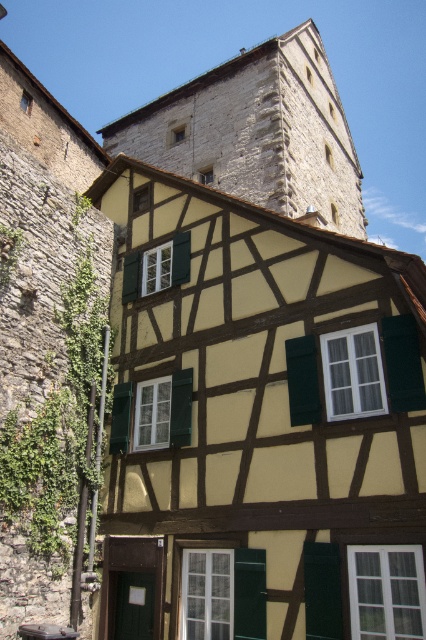
Question: Can you confirm if stone tower at upper center is wider than green matte shutter at center?

Choices:
 (A) no
 (B) yes

Answer: (B)

Question: Does stone tower at upper center have a smaller size compared to green matte shutter at center?

Choices:
 (A) no
 (B) yes

Answer: (A)

Question: Can you confirm if stone tower at upper center is positioned below green matte shutter at center?

Choices:
 (A) no
 (B) yes

Answer: (A)